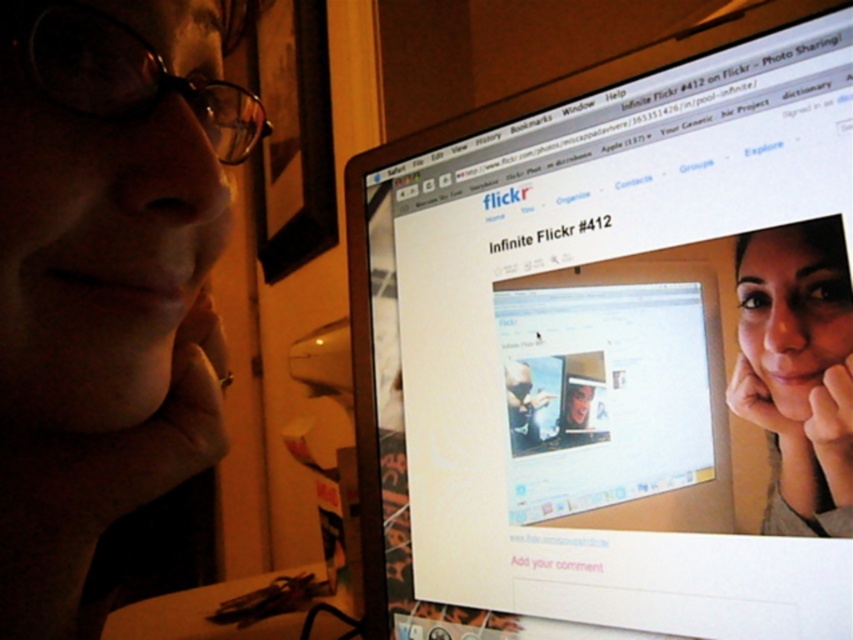
Question: Which of the following is the farthest from the observer?

Choices:
 (A) matte skin face at center
 (B) white glossy monitor at upper center

Answer: (A)

Question: Which point is closer to the camera taking this photo?

Choices:
 (A) (766, 429)
 (B) (840, 529)

Answer: (B)

Question: Is white glossy monitor at upper center wider than matte skin face at center?

Choices:
 (A) yes
 (B) no

Answer: (A)

Question: Considering the relative positions of white glossy monitor at upper center and matte skin face at center in the image provided, where is white glossy monitor at upper center located with respect to matte skin face at center?

Choices:
 (A) right
 (B) left

Answer: (B)

Question: Can you confirm if white glossy monitor at upper center is bigger than matte skin face at center?

Choices:
 (A) yes
 (B) no

Answer: (A)